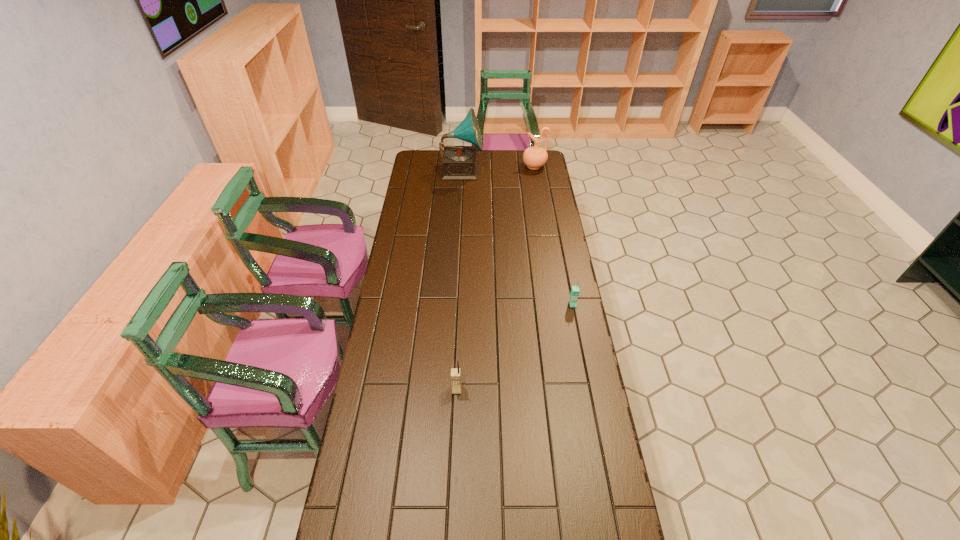
This screenshot has height=540, width=960. In order to click on free space between the left cellular telephone and the pottery in this screenshot , I will do [495, 278].

Find the location of a particular element. free space between the pottery and the tallest object is located at coordinates (498, 168).

Image resolution: width=960 pixels, height=540 pixels. I want to click on vacant area between the pottery and the farther cellular telephone, so click(x=554, y=235).

You are a GUI agent. You are given a task and a screenshot of the screen. Output one action in this format:
    pyautogui.click(x=<x>, y=<y>)
    Task: Click on the unoccupied area between the right cellular telephone and the record player
    
    Given the screenshot: What is the action you would take?
    pyautogui.click(x=517, y=237)

Locate an element on the screen. The image size is (960, 540). blank region between the pottery and the right cellular telephone is located at coordinates (554, 235).

I want to click on free space between the shorter cellular telephone and the pottery, so click(554, 235).

Identify the location of free spot between the record player and the nearest object. Image resolution: width=960 pixels, height=540 pixels. (459, 280).

I want to click on free space between the farther cellular telephone and the left cellular telephone, so click(x=515, y=347).

You are a GUI agent. You are given a task and a screenshot of the screen. Output one action in this format:
    pyautogui.click(x=<x>, y=<y>)
    Task: Click on the free point between the nearest object and the shorter cellular telephone
    Image resolution: width=960 pixels, height=540 pixels.
    Given the screenshot: What is the action you would take?
    pyautogui.click(x=515, y=347)

Identify the location of free space between the pottery and the third tallest object. (495, 278).